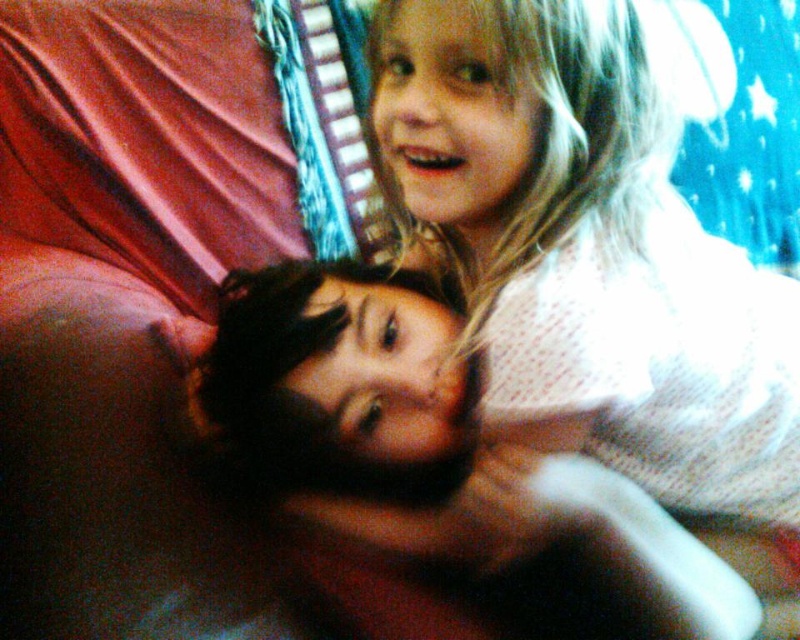
Question: Can you confirm if white dotted shirt at upper center is positioned to the left of smooth skin face at center?

Choices:
 (A) yes
 (B) no

Answer: (B)

Question: Can you confirm if white dotted shirt at upper center is wider than smooth skin face at center?

Choices:
 (A) no
 (B) yes

Answer: (A)

Question: Can you confirm if white dotted shirt at upper center is thinner than smooth skin face at center?

Choices:
 (A) no
 (B) yes

Answer: (B)